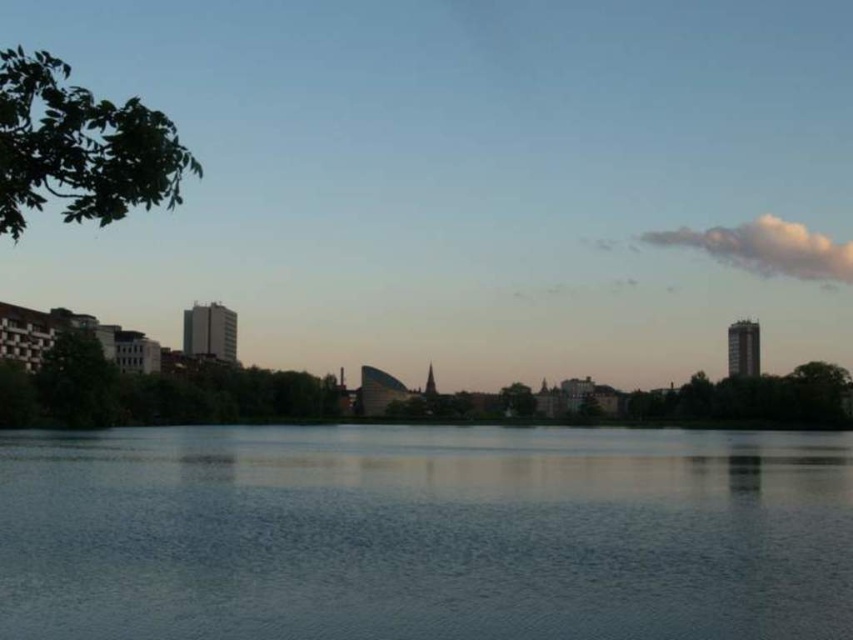
Question: Observing the image, what is the correct spatial positioning of green leafy branch at upper left in reference to green matte tree at left?

Choices:
 (A) left
 (B) right

Answer: (A)

Question: Is green matte tree at left positioned in front of green leafy tree at center?

Choices:
 (A) yes
 (B) no

Answer: (A)

Question: Among these objects, which one is farthest from the camera?

Choices:
 (A) green leafy branch at upper left
 (B) smooth water at center
 (C) green leafy tree at right

Answer: (C)

Question: Considering the real-world distances, which object is closest to the green leafy tree at center?

Choices:
 (A) green leafy tree at right
 (B) green matte tree at left
 (C) smooth water at center
 (D) green leafy branch at upper left

Answer: (A)

Question: Which point is farther to the camera?

Choices:
 (A) (62, 378)
 (B) (795, 372)

Answer: (B)

Question: Is the position of green leafy tree at right less distant than that of green matte tree at left?

Choices:
 (A) yes
 (B) no

Answer: (B)